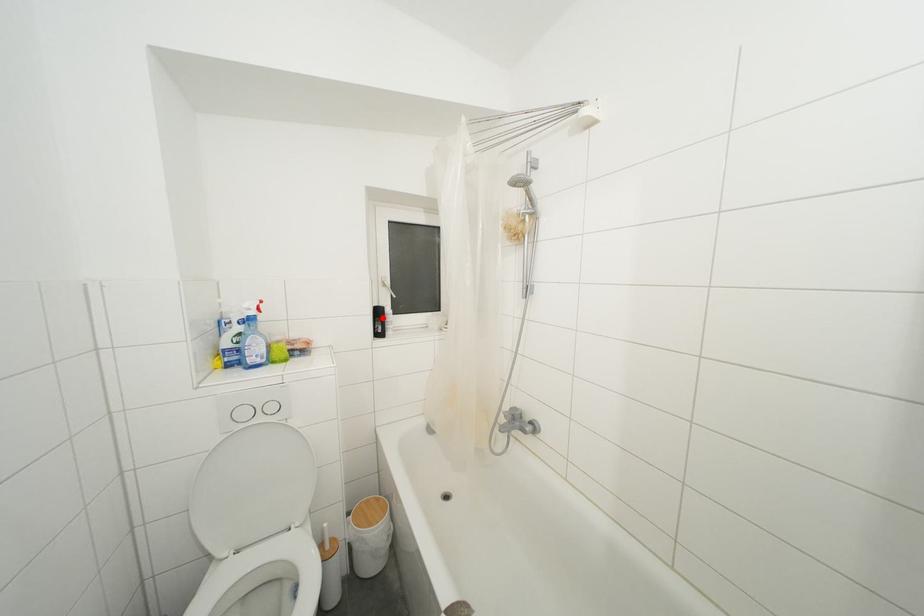
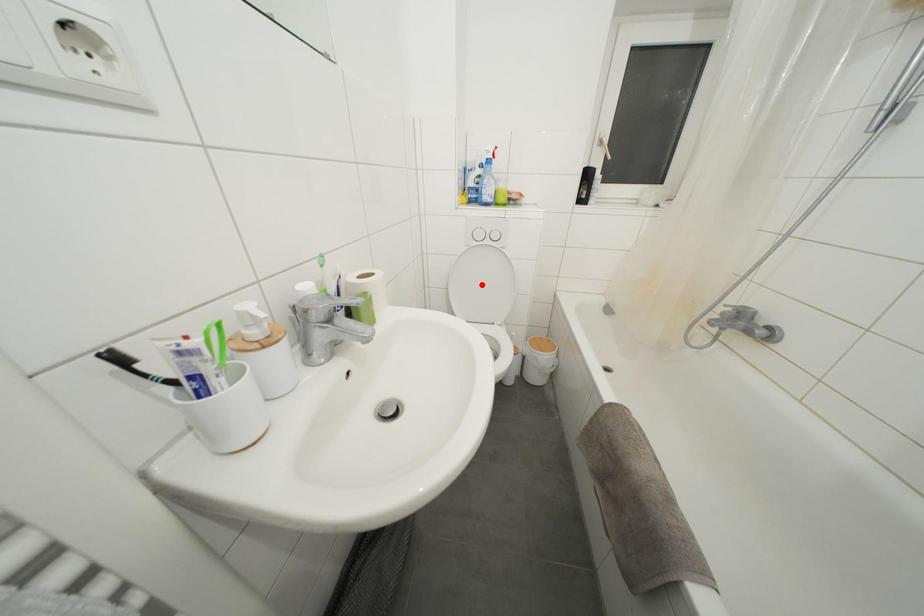
I am providing you with two images of the same scene from different viewpoints. A red point is marked on the first image and another point is marked on the second image. Does the point marked in image1 correspond to the same location as the one in image2?

No